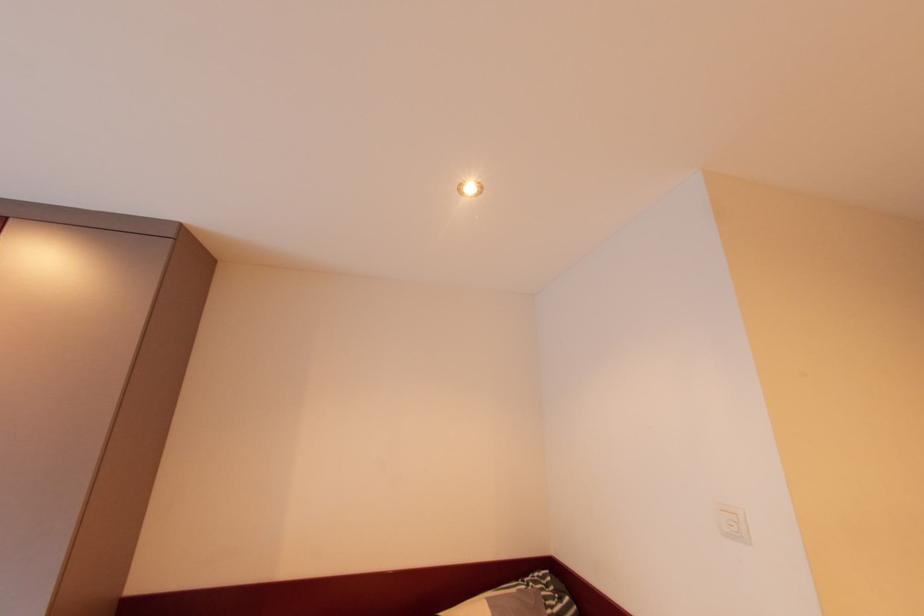
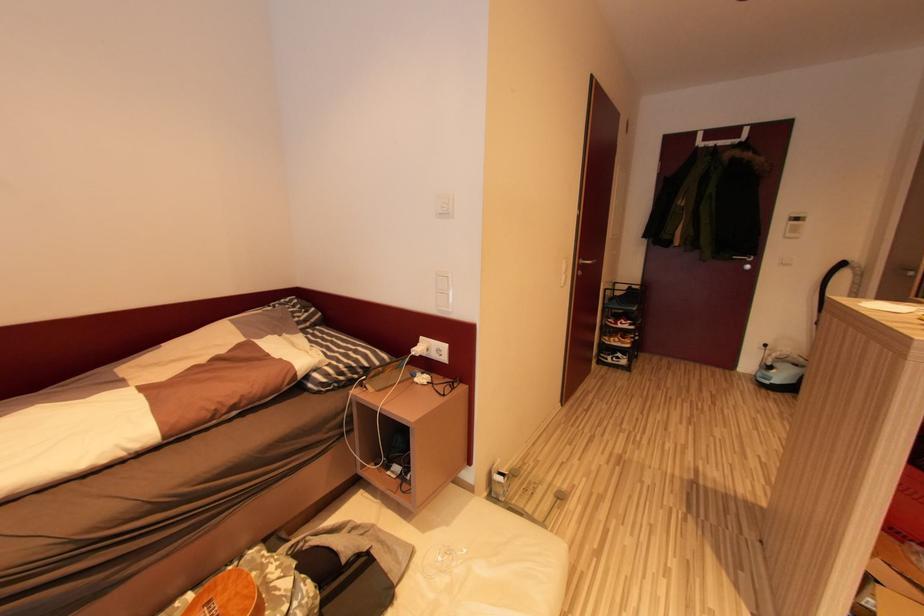
Based on the photo, the images are taken continuously from a first-person perspective. In which direction is your viewpoint rotating?

The camera's rotation is toward right-down.